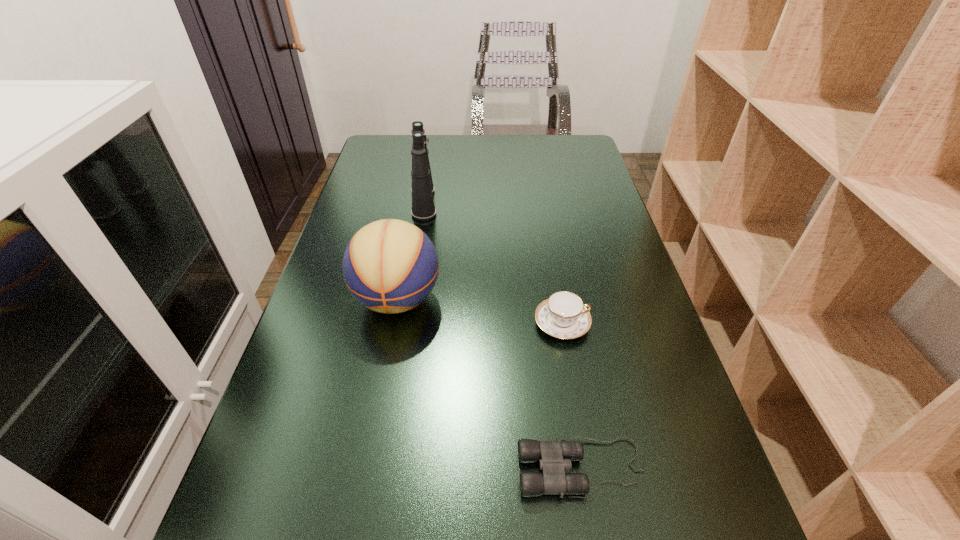
This screenshot has width=960, height=540. Find the location of `blank space located 0.390m at the eyepiece of the nearest object`. blank space located 0.390m at the eyepiece of the nearest object is located at coordinates (278, 468).

The image size is (960, 540). What are the coordinates of `vacant space located at the eyepiece of the nearest object` in the screenshot? It's located at (390, 468).

This screenshot has width=960, height=540. What are the coordinates of `object at the left edge` in the screenshot? It's located at (390, 266).

At what (x,y) coordinates should I click in order to perform the action: click on teacup at the right edge. Please return your answer as a coordinate pair (x, y). Image resolution: width=960 pixels, height=540 pixels. Looking at the image, I should click on (563, 315).

This screenshot has height=540, width=960. I want to click on binoculars present at the right edge, so click(554, 457).

Identify the location of vacant region at the far edge of the desktop. (443, 158).

The width and height of the screenshot is (960, 540). What are the coordinates of `vacant space at the left edge` in the screenshot? It's located at (243, 471).

Where is `free location at the right edge`? This screenshot has height=540, width=960. free location at the right edge is located at coordinates (553, 172).

Identify the location of vacant area at the far left corner. The width and height of the screenshot is (960, 540). (397, 147).

In the image, there is a desktop. Find the location of `blank space at the far right corner`. blank space at the far right corner is located at coordinates (587, 167).